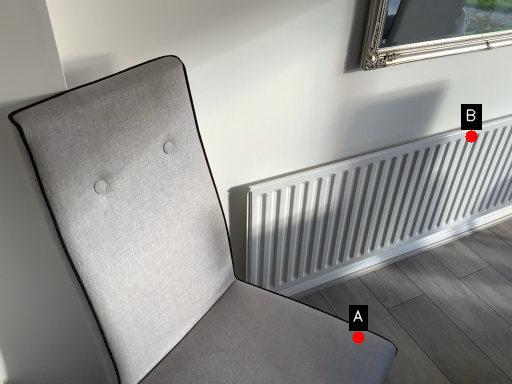
Question: Two points are circled on the image, labeled by A and B beside each circle. Among these points, which one is farthest from the camera?

Choices:
 (A) A is further
 (B) B is further

Answer: (B)